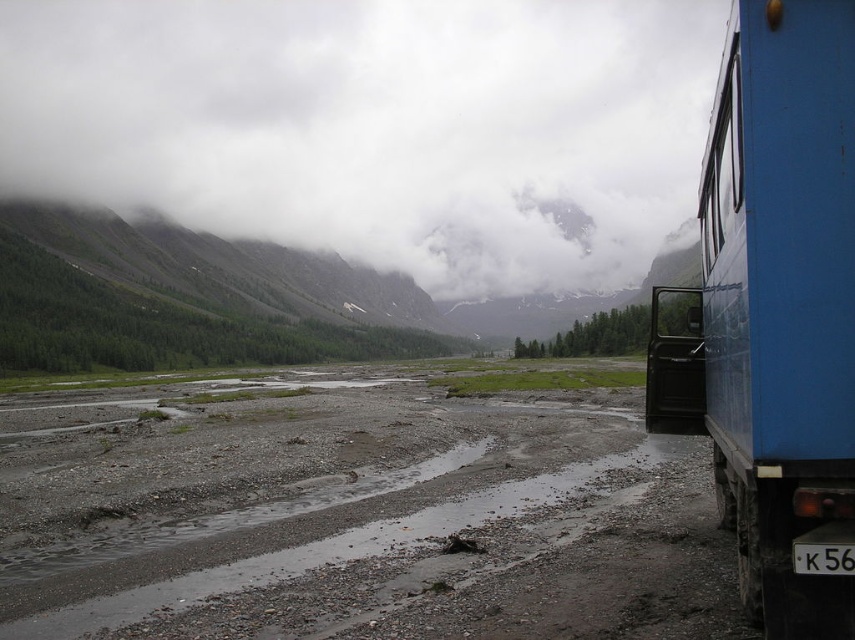
Question: Which point appears closest to the camera in this image?

Choices:
 (A) (835, 560)
 (B) (496, 570)
 (C) (703, 433)
 (D) (16, 131)

Answer: (A)

Question: Which point is closer to the camera?

Choices:
 (A) blue metallic truck at right
 (B) damp gravel dirt track at center
 (C) black plastic license plate at lower right

Answer: (C)

Question: Is cloudy fog at upper center thinner than black plastic license plate at lower right?

Choices:
 (A) no
 (B) yes

Answer: (A)

Question: Can you confirm if blue metallic truck at right is positioned to the right of black plastic license plate at lower right?

Choices:
 (A) yes
 (B) no

Answer: (A)

Question: Is damp gravel dirt track at center wider than blue metallic truck at right?

Choices:
 (A) yes
 (B) no

Answer: (A)

Question: Which of the following is the farthest from the observer?

Choices:
 (A) cloudy fog at upper center
 (B) damp gravel dirt track at center
 (C) blue metallic truck at right

Answer: (A)